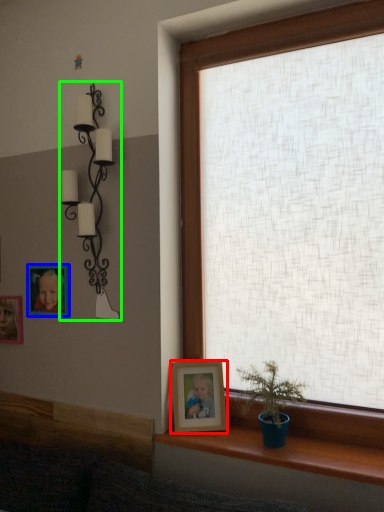
Question: Which object is positioned farthest from picture frame (highlighted by a red box)? Select from picture frame (highlighted by a blue box) and lamp (highlighted by a green box).

Choices:
 (A) picture frame
 (B) lamp

Answer: (A)